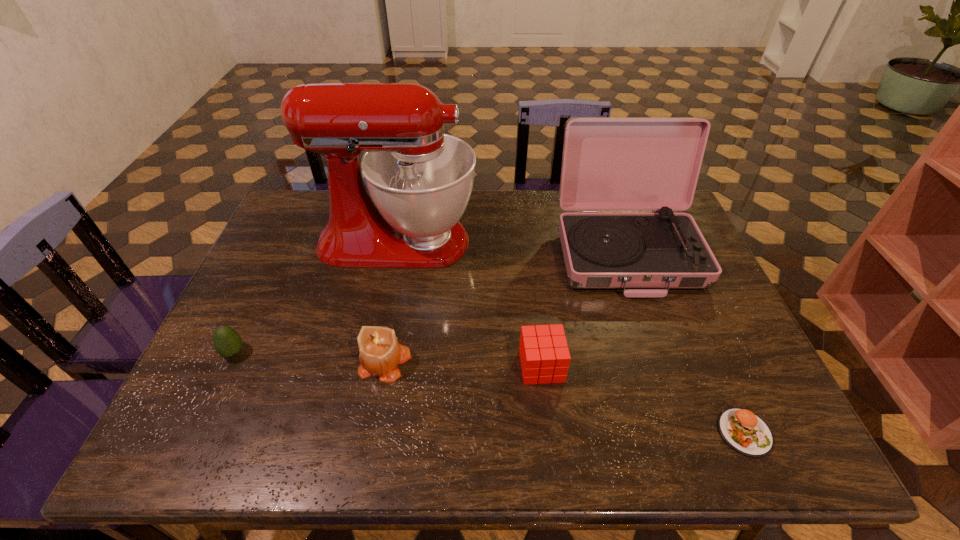
Identify the location of object that is positioned at the far left corner. The width and height of the screenshot is (960, 540). (419, 180).

At what (x,y) coordinates should I click in order to perform the action: click on object that is positioned at the far right corner. Please return your answer as a coordinate pair (x, y). Image resolution: width=960 pixels, height=540 pixels. Looking at the image, I should click on (609, 164).

Where is `object at the near right corner`? The width and height of the screenshot is (960, 540). object at the near right corner is located at coordinates (745, 432).

In the image, there is a desktop. Identify the location of blank space at the far edge. (612, 212).

Locate an element on the screen. Image resolution: width=960 pixels, height=540 pixels. free space at the near edge of the desktop is located at coordinates (257, 454).

Where is `free space at the left edge of the desktop`? free space at the left edge of the desktop is located at coordinates (271, 329).

At what (x,y) coordinates should I click in order to perform the action: click on vacant space at the right edge of the desktop. Please return your answer as a coordinate pair (x, y). Looking at the image, I should click on (688, 339).

Find the location of a particular element. The width and height of the screenshot is (960, 540). vacant space at the far left corner is located at coordinates (292, 198).

The height and width of the screenshot is (540, 960). I want to click on vacant space at the near left corner of the desktop, so click(177, 421).

This screenshot has height=540, width=960. In order to click on free spot between the leftmost object and the third tallest object in this screenshot , I will do `click(309, 357)`.